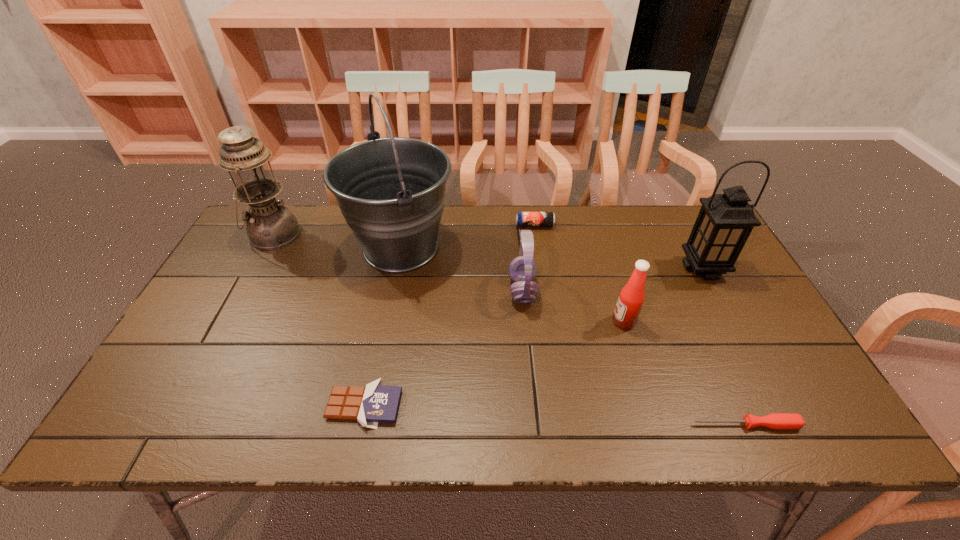
This screenshot has height=540, width=960. What are the coordinates of `free space located 0.310m on the front of the lantern` in the screenshot? It's located at pos(760,376).

Where is `free space located on the front-facing side of the sixth object from left to right`? The image size is (960, 540). free space located on the front-facing side of the sixth object from left to right is located at coordinates (514, 322).

This screenshot has width=960, height=540. What are the coordinates of `free spot located on the front-facing side of the sixth object from left to right` in the screenshot? It's located at (555, 322).

This screenshot has height=540, width=960. What are the coordinates of `blank area located on the front-facing side of the sixth object from left to right` in the screenshot? It's located at (468, 322).

In order to click on vacant space located on the headband and ear cups of the headset in this screenshot , I will do `click(388, 290)`.

Locate an element on the screen. This screenshot has height=540, width=960. vacant space located on the headband and ear cups of the headset is located at coordinates (480, 290).

I want to click on vacant region located on the headband and ear cups of the headset, so click(x=491, y=290).

Find the location of a particular element. The height and width of the screenshot is (540, 960). vacant area situated 0.320m on the front of the sixth tallest object is located at coordinates (546, 302).

At what (x,y) coordinates should I click in order to perform the action: click on vacant space located at the tip of the screwdriver. Please return your answer as a coordinate pair (x, y). The image size is (960, 540). Looking at the image, I should click on (656, 424).

Where is `blank area located 0.160m at the tip of the screwdriver`? blank area located 0.160m at the tip of the screwdriver is located at coordinates (618, 424).